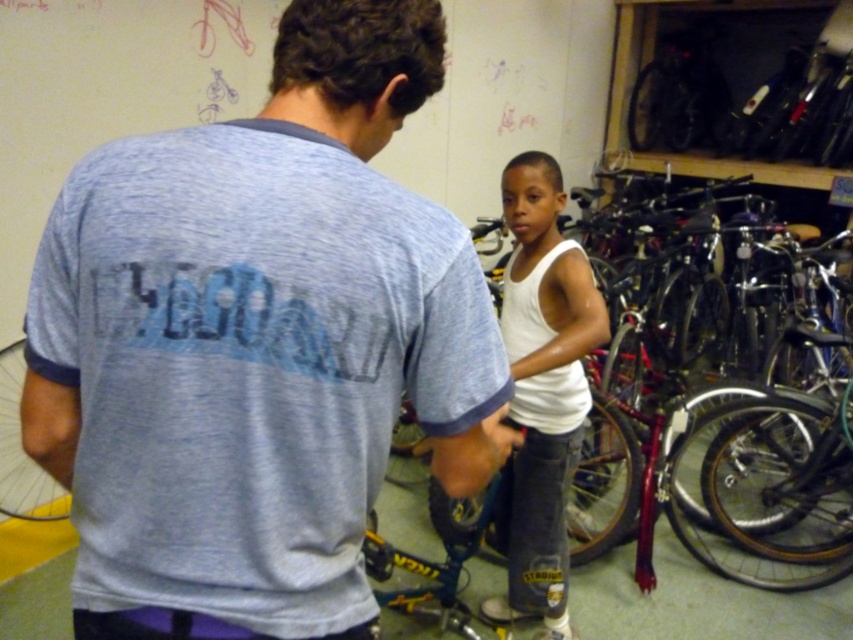
Can you confirm if light blue heathered t-shirt at center is smaller than white cotton tank top at center?

Yes.

Is point (396, 385) positioned after point (537, 266)?

No, (396, 385) is in front of (537, 266).

The image size is (853, 640). Identify the location of light blue heathered t-shirt at center. (257, 344).